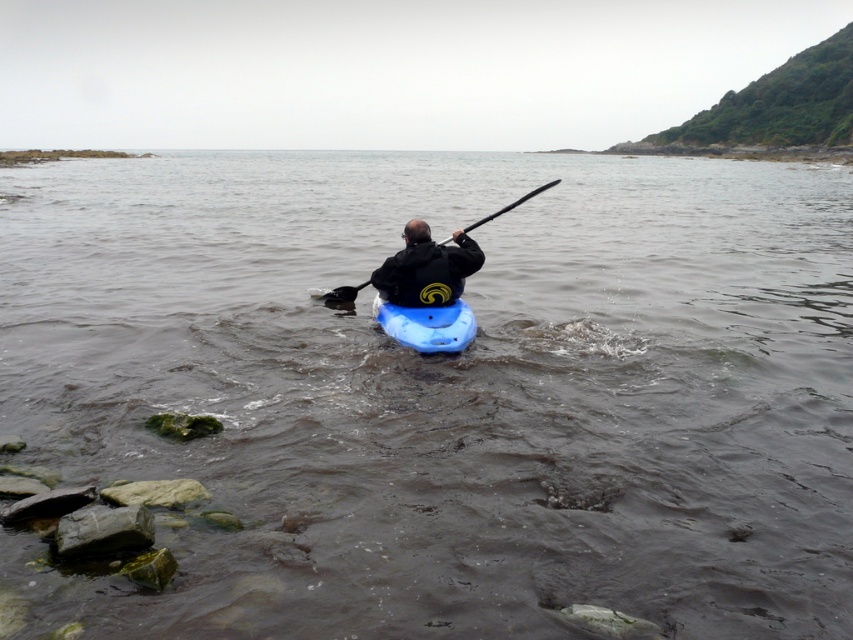
Which is below, black matte jacket at center or blue matte kayak at center?

Positioned lower is blue matte kayak at center.

Which is in front, point (444, 278) or point (425, 326)?

Positioned in front is point (425, 326).

Find the location of a particular element. The width and height of the screenshot is (853, 640). black matte jacket at center is located at coordinates (426, 268).

Between blue matte kayak at center and black plastic paddle at center, which one appears on the left side from the viewer's perspective?

Positioned to the left is blue matte kayak at center.

Which is behind, point (439, 337) or point (352, 294)?

Point (352, 294)

Locate an element on the screen. The image size is (853, 640). blue matte kayak at center is located at coordinates (427, 324).

Is black matte jacket at center positioned before black plastic paddle at center?

Yes, black matte jacket at center is in front of black plastic paddle at center.

Who is more distant from viewer, (424, 262) or (524, 200)?

The point (524, 200) is more distant.

Which is behind, point (428, 241) or point (440, 241)?

Positioned behind is point (440, 241).

The width and height of the screenshot is (853, 640). Find the location of `black matte jacket at center`. black matte jacket at center is located at coordinates (426, 268).